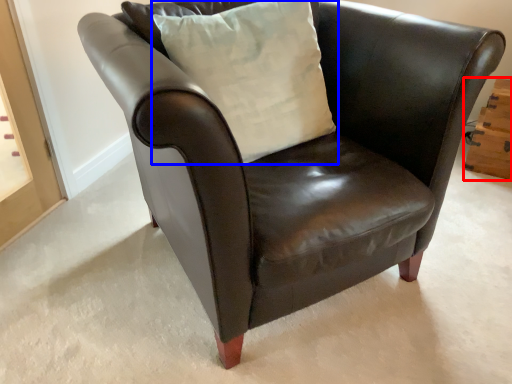
Question: Which object is closer to the camera taking this photo, drawer (highlighted by a red box) or pillow (highlighted by a blue box)?

Choices:
 (A) drawer
 (B) pillow

Answer: (B)